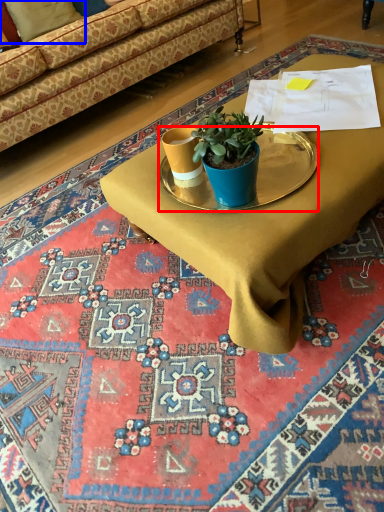
Question: Which object appears farthest to the camera in this image, round table (highlighted by a red box) or pillow (highlighted by a blue box)?

Choices:
 (A) round table
 (B) pillow

Answer: (B)